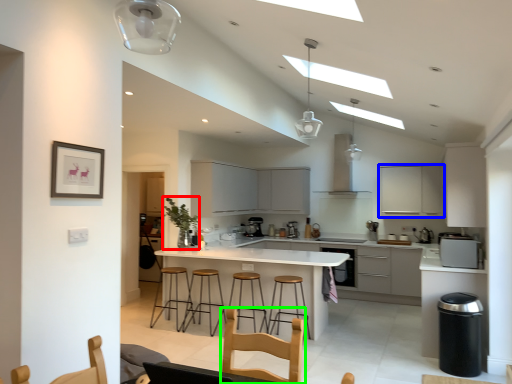
Question: Based on their relative distances, which object is farther from plant (highlighted by a red box)? Choose from cabinetry (highlighted by a blue box) and swivel chair (highlighted by a green box).

Choices:
 (A) cabinetry
 (B) swivel chair

Answer: (A)